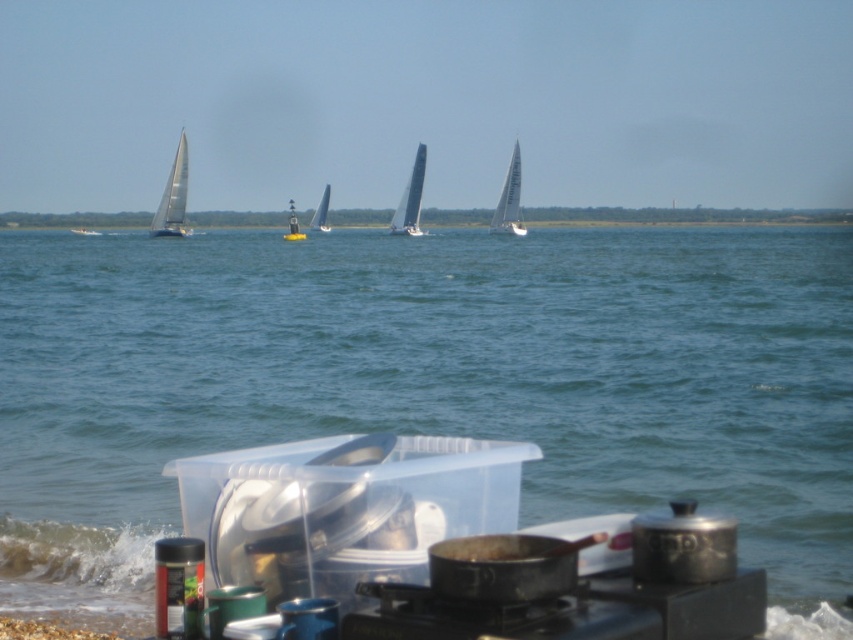
You are planning to take a photo of the clear plastic container at center and the blue water at center. Which one should you focus on to ensure the subject is sharp and in focus, considering their sizes?

The blue water at center has a larger size compared to the clear plastic container at center, so focusing on the blue water at center would ensure the subject is sharp and in focus.

You are setting up a picnic near the shoreline and notice the black matte stove at lower center and the white sailboat at left. Which object is closer to you as you stand at the picnic area?

The black matte stove at lower center is closer to you because it is positioned in front of the white sailboat at left.

You are setting up a picnic area and need to place the black matte stove at lower center and the yellow buoy at center. Given their sizes, which object should you place first to ensure both fit comfortably in the space?

The black matte stove at lower center occupies less space than the yellow buoy at center, so you should place the yellow buoy at center first to ensure there is enough space for both objects.